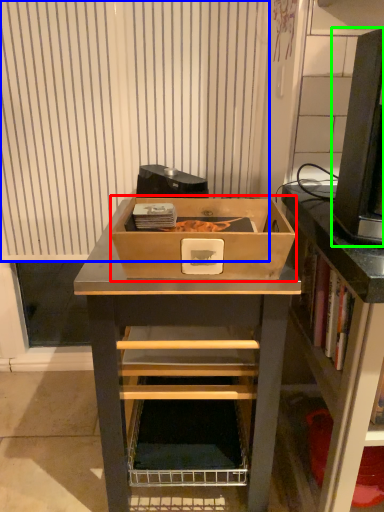
Question: Which object is the farthest from box (highlighted by a red box)? Choose among these: curtain (highlighted by a blue box) or desktop computer (highlighted by a green box).

Choices:
 (A) curtain
 (B) desktop computer

Answer: (A)